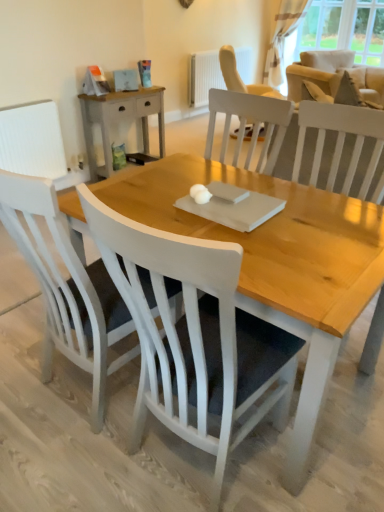
Question: Should I look upward or downward to see light wood/rough surface nightstand at upper left?

Choices:
 (A) up
 (B) down

Answer: (A)

Question: Is white matte chair at lower left, arranged as the 3th chair when viewed from the right, not within white textured curtain at upper right?

Choices:
 (A) yes
 (B) no

Answer: (A)

Question: Can you confirm if white matte chair at lower left, arranged as the 1th chair when viewed from the left, is bigger than white textured curtain at upper right?

Choices:
 (A) yes
 (B) no

Answer: (B)

Question: From a real-world perspective, is white matte chair at lower left, arranged as the 3th chair when viewed from the right, under white textured curtain at upper right?

Choices:
 (A) yes
 (B) no

Answer: (A)

Question: Considering the relative positions of white matte chair at lower left, which ranks as the 2th chair in front-to-back order, and white textured curtain at upper right in the image provided, is white matte chair at lower left, which ranks as the 2th chair in front-to-back order, to the right of white textured curtain at upper right from the viewer's perspective?

Choices:
 (A) no
 (B) yes

Answer: (A)

Question: Is there a large distance between white matte chair at lower left, which is counted as the 2th chair, starting from the back, and white textured curtain at upper right?

Choices:
 (A) no
 (B) yes

Answer: (B)

Question: Considering the relative positions of white matte chair at lower left, which is counted as the 2th chair, starting from the back, and white textured curtain at upper right in the image provided, is white matte chair at lower left, which is counted as the 2th chair, starting from the back, behind white textured curtain at upper right?

Choices:
 (A) no
 (B) yes

Answer: (A)

Question: Is white textured curtain at upper right far away from beige fabric armchair at upper right?

Choices:
 (A) yes
 (B) no

Answer: (B)

Question: Is white textured curtain at upper right touching beige fabric armchair at upper right?

Choices:
 (A) no
 (B) yes

Answer: (A)

Question: Would you say white textured curtain at upper right contains beige fabric armchair at upper right?

Choices:
 (A) yes
 (B) no

Answer: (B)

Question: From a real-world perspective, is white textured curtain at upper right physically below beige fabric armchair at upper right?

Choices:
 (A) no
 (B) yes

Answer: (A)

Question: Does white textured curtain at upper right have a greater width compared to beige fabric armchair at upper right?

Choices:
 (A) no
 (B) yes

Answer: (A)

Question: From the image's perspective, is white textured curtain at upper right located above beige fabric armchair at upper right?

Choices:
 (A) yes
 (B) no

Answer: (A)

Question: Could you tell me if light wood/rough surface nightstand at upper left is turned towards white wood chair at center, which is the second chair from left to right?

Choices:
 (A) no
 (B) yes

Answer: (A)